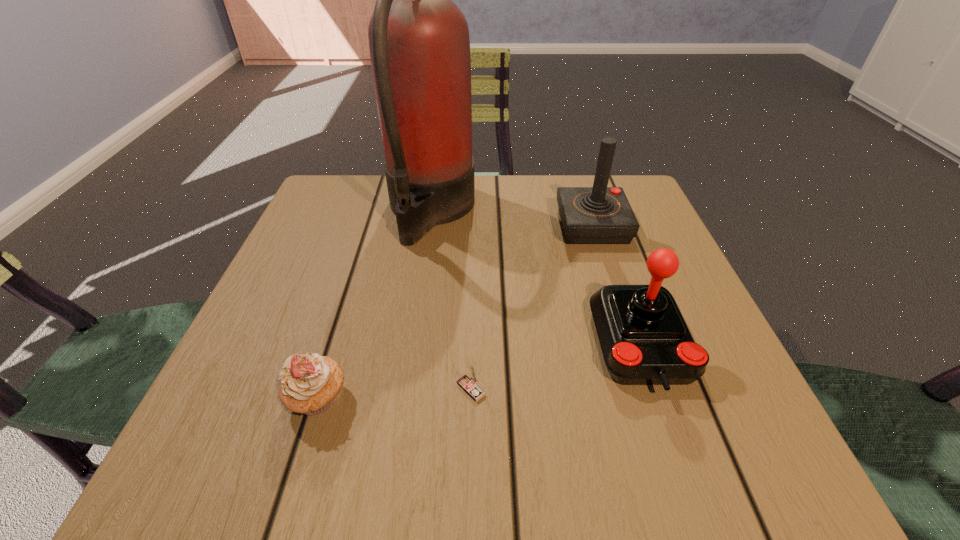
At what (x,y) coordinates should I click in order to perform the action: click on free location at the left edge. Please return your answer as a coordinate pair (x, y). This screenshot has height=540, width=960. Looking at the image, I should click on (242, 382).

The width and height of the screenshot is (960, 540). In the image, there is a desktop. Find the location of `vacant space at the right edge`. vacant space at the right edge is located at coordinates (648, 245).

Where is `blank space at the far left corner of the desktop`? This screenshot has height=540, width=960. blank space at the far left corner of the desktop is located at coordinates (325, 206).

Where is `vacant area between the fourth tallest object and the nearer joystick`? The width and height of the screenshot is (960, 540). vacant area between the fourth tallest object and the nearer joystick is located at coordinates (480, 372).

Where is `vacant area that lies between the nearer joystick and the matchbox`? This screenshot has height=540, width=960. vacant area that lies between the nearer joystick and the matchbox is located at coordinates (557, 367).

Image resolution: width=960 pixels, height=540 pixels. Find the location of `free space between the nearer joystick and the fire extinguisher`. free space between the nearer joystick and the fire extinguisher is located at coordinates (537, 278).

Where is `free point between the fire extinguisher and the nearer joystick`? The image size is (960, 540). free point between the fire extinguisher and the nearer joystick is located at coordinates (537, 278).

Image resolution: width=960 pixels, height=540 pixels. Find the location of `empty location between the fire extinguisher and the farther joystick`. empty location between the fire extinguisher and the farther joystick is located at coordinates (512, 219).

Locate an element on the screen. Image resolution: width=960 pixels, height=540 pixels. free area in between the shortest object and the nearer joystick is located at coordinates (557, 367).

Where is `empty space between the matchbox and the second shortest object`? empty space between the matchbox and the second shortest object is located at coordinates point(395,394).